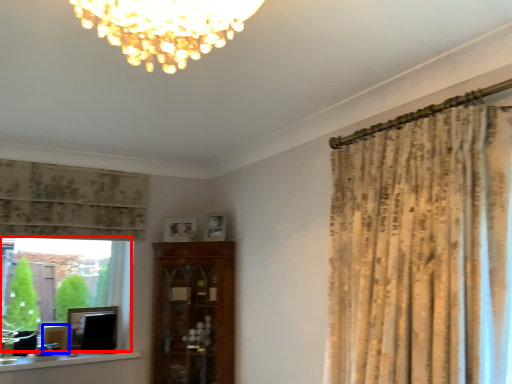
Question: Among these objects, which one is nearest to the camera, bay window (highlighted by a red box) or picture frame (highlighted by a blue box)?

Choices:
 (A) bay window
 (B) picture frame

Answer: (A)